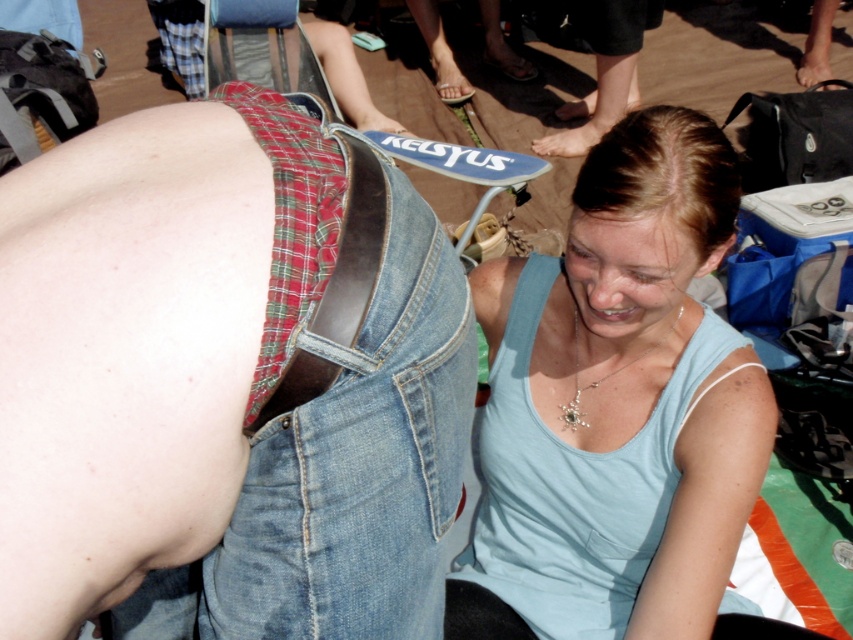
Question: Among these objects, which one is nearest to the camera?

Choices:
 (A) leather belt at center
 (B) light blue tank top at center
 (C) denim at center

Answer: (C)

Question: Is denim at center wider than leather belt at center?

Choices:
 (A) yes
 (B) no

Answer: (A)

Question: Is light blue tank top at center thinner than denim at center?

Choices:
 (A) yes
 (B) no

Answer: (B)

Question: Can you confirm if denim at center is thinner than leather belt at center?

Choices:
 (A) yes
 (B) no

Answer: (B)

Question: Which point is closer to the camera?

Choices:
 (A) (393, 228)
 (B) (758, 433)

Answer: (A)

Question: Which point appears farthest from the camera in this image?

Choices:
 (A) click(192, 563)
 (B) click(625, 500)
 (C) click(341, 236)

Answer: (B)